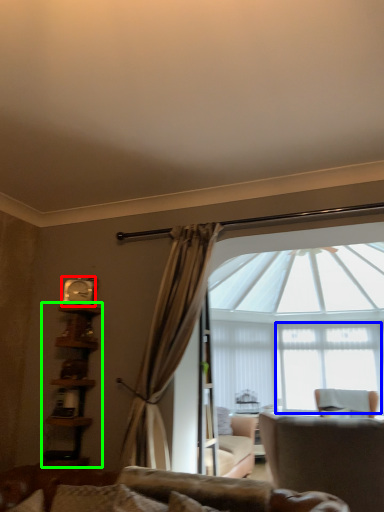
Question: Which object is positioned farthest from clock (highlighted by a red box)? Select from window screen (highlighted by a blue box) and bookshelf (highlighted by a green box).

Choices:
 (A) window screen
 (B) bookshelf

Answer: (A)